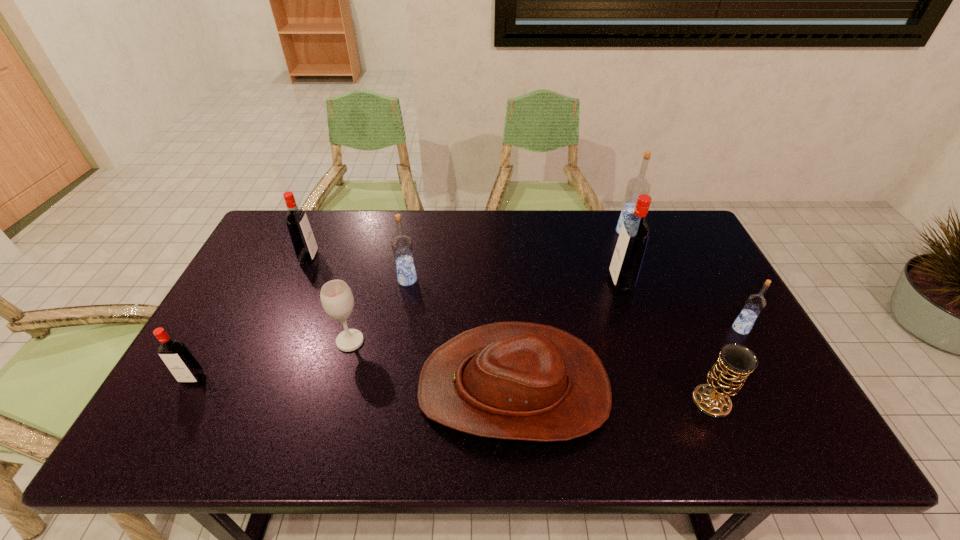
Find the location of a particular element. The image size is (960, 540). the farthest object is located at coordinates (639, 185).

In order to click on the second blue vodka from right to left in this screenshot , I will do `click(639, 185)`.

Where is `the sixth object from left to right`? This screenshot has height=540, width=960. the sixth object from left to right is located at coordinates (627, 259).

This screenshot has height=540, width=960. Identify the location of the biggest red vodka. (627, 259).

You are a GUI agent. You are given a task and a screenshot of the screen. Output one action in this format:
    pyautogui.click(x=<x>, y=<y>)
    Task: Click on the eighth nearest object
    This screenshot has height=540, width=960.
    Given the screenshot: What is the action you would take?
    pyautogui.click(x=303, y=241)

At what (x,y) coordinates should I click in order to perform the action: click on the second smallest red vodka. Please return your answer as a coordinate pair (x, y). The height and width of the screenshot is (540, 960). Looking at the image, I should click on (303, 241).

Locate an element on the screen. The image size is (960, 540). the second nearest blue vodka is located at coordinates (402, 246).

Identify the location of the sixth object from right to left. click(402, 246).

This screenshot has width=960, height=540. I want to click on the seventh object from right to left, so click(x=336, y=296).

The image size is (960, 540). In order to click on the leftmost vodka in this screenshot , I will do `click(185, 368)`.